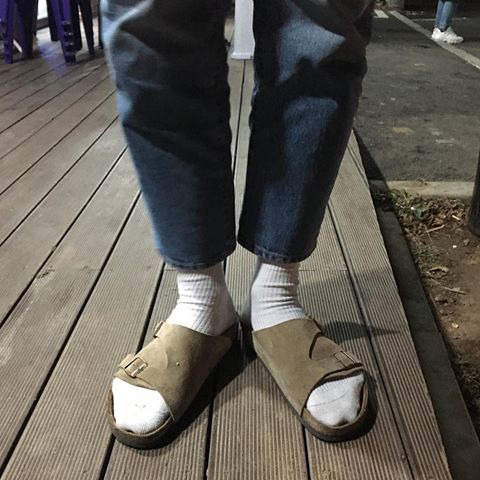
You are a GUI agent. You are given a task and a screenshot of the screen. Output one action in this format:
    pyautogui.click(x=<x>, y=<y>)
    Task: Click on the stack of chairs
    Image resolution: width=480 pixels, height=480 pixels.
    Given the screenshot: What is the action you would take?
    pyautogui.click(x=64, y=13)